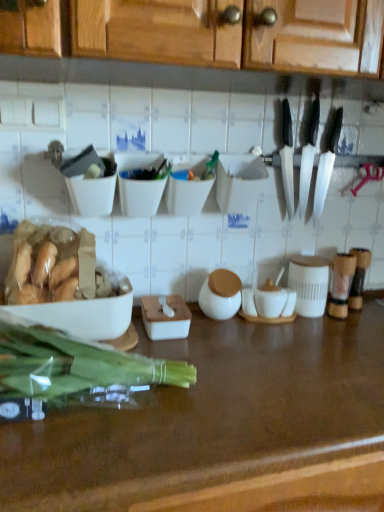
Question: Is white matte bowl at upper left, the third bowl from the right, shorter than silver metallic knife at upper right, arranged as the first kitchen knife when viewed from the right?

Choices:
 (A) no
 (B) yes

Answer: (B)

Question: Is white matte bowl at upper left, the third bowl from the right, bigger than silver metallic knife at upper right, positioned as the second kitchen knife in left-to-right order?

Choices:
 (A) yes
 (B) no

Answer: (B)

Question: From a real-world perspective, is white matte bowl at upper left, the 1th bowl viewed from the left, located higher than silver metallic knife at upper right, positioned as the second kitchen knife in left-to-right order?

Choices:
 (A) yes
 (B) no

Answer: (B)

Question: Is white matte bowl at upper left, the third bowl from the right, taller than silver metallic knife at upper right, positioned as the second kitchen knife in left-to-right order?

Choices:
 (A) yes
 (B) no

Answer: (B)

Question: Is white matte bowl at upper left, the 1th bowl viewed from the left, directly adjacent to silver metallic knife at upper right, arranged as the first kitchen knife when viewed from the right?

Choices:
 (A) yes
 (B) no

Answer: (B)

Question: Looking at their shapes, would you say white matte bowl at left is wider or thinner than black plastic knives at upper right?

Choices:
 (A) wide
 (B) thin

Answer: (A)

Question: Is white matte bowl at left taller or shorter than black plastic knives at upper right?

Choices:
 (A) tall
 (B) short

Answer: (B)

Question: In the image, is white matte bowl at left on the left side or the right side of black plastic knives at upper right?

Choices:
 (A) right
 (B) left

Answer: (B)

Question: From a real-world perspective, is white matte bowl at left positioned above or below black plastic knives at upper right?

Choices:
 (A) below
 (B) above

Answer: (A)

Question: From their relative heights in the image, would you say silver metallic knife at upper right, arranged as the first kitchen knife when viewed from the right, is taller or shorter than white plastic container at center, acting as the third bowl starting from the left?

Choices:
 (A) short
 (B) tall

Answer: (B)

Question: Is silver metallic knife at upper right, arranged as the first kitchen knife when viewed from the right, situated inside white plastic container at center, the 1th bowl from the right, or outside?

Choices:
 (A) inside
 (B) outside

Answer: (B)

Question: From the image's perspective, is silver metallic knife at upper right, positioned as the second kitchen knife in left-to-right order, positioned above or below white plastic container at center, the 1th bowl from the right?

Choices:
 (A) above
 (B) below

Answer: (A)

Question: Is point (321, 187) closer or farther from the camera than point (173, 205)?

Choices:
 (A) farther
 (B) closer

Answer: (A)

Question: Is white plastic container at center, the 1th bowl from the right, in front of or behind white matte bowl at left in the image?

Choices:
 (A) front
 (B) behind

Answer: (B)

Question: From a real-world perspective, is white plastic container at center, acting as the third bowl starting from the left, physically located above or below white matte bowl at left?

Choices:
 (A) above
 (B) below

Answer: (A)